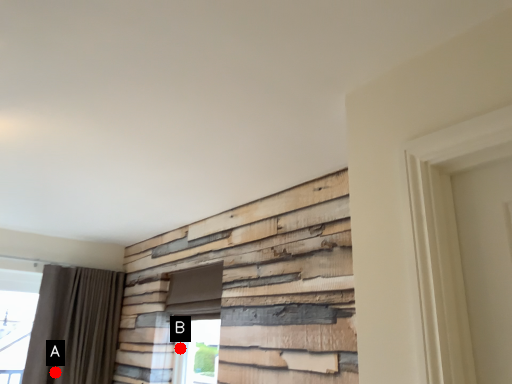
Question: Two points are circled on the image, labeled by A and B beside each circle. Which point is farther from the camera taking this photo?

Choices:
 (A) A is further
 (B) B is further

Answer: (A)